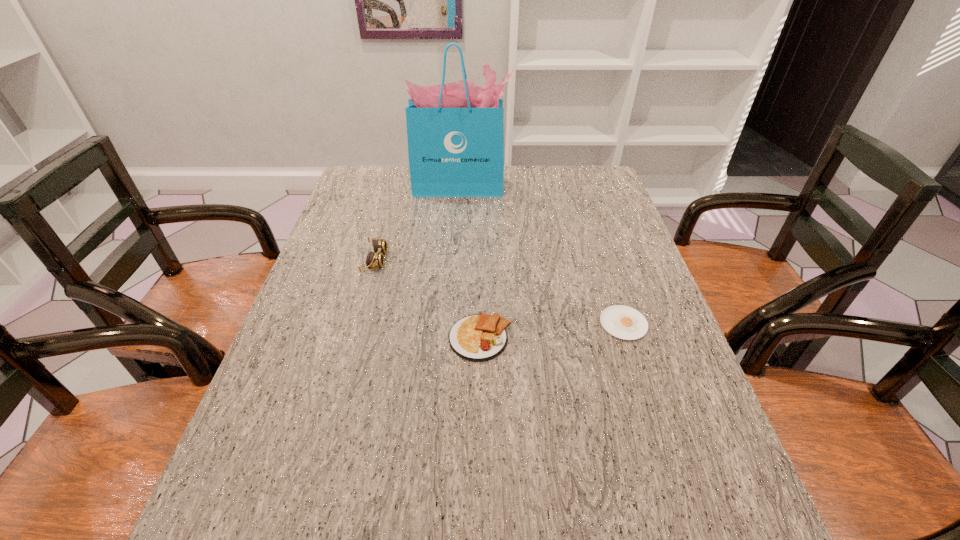
Where is `shopping bag`? The image size is (960, 540). shopping bag is located at coordinates (455, 131).

At what (x,y) coordinates should I click in order to perform the action: click on the farthest object. Please return your answer as a coordinate pair (x, y). The image size is (960, 540). Looking at the image, I should click on (455, 131).

Locate an element on the screen. The height and width of the screenshot is (540, 960). the second farthest object is located at coordinates (375, 259).

Find the location of a particular element. the leftmost object is located at coordinates (375, 259).

This screenshot has height=540, width=960. Identify the location of omelet. (480, 337).

Image resolution: width=960 pixels, height=540 pixels. In order to click on the shortest object in this screenshot , I will do `click(623, 322)`.

The height and width of the screenshot is (540, 960). I want to click on egg yolk, so click(623, 322).

What are the coordinates of `vacant space located on the front of the tallest object` in the screenshot? It's located at (457, 252).

In order to click on vacant space located through the lenses of the leftmost object in this screenshot , I will do `click(523, 261)`.

At what (x,y) coordinates should I click in order to perform the action: click on free point located 0.180m on the left of the third tallest object. Please return your answer as a coordinate pair (x, y). Looking at the image, I should click on pos(371,338).